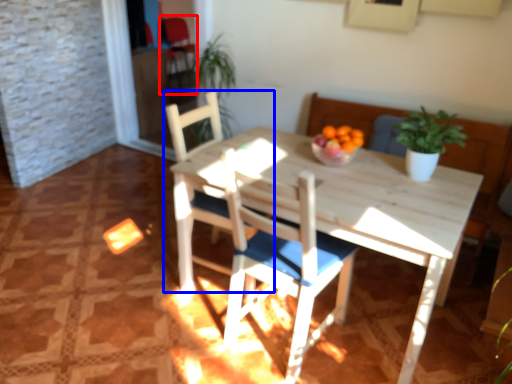
Question: Among these objects, which one is farthest to the camera, armchair (highlighted by a red box) or chair (highlighted by a blue box)?

Choices:
 (A) armchair
 (B) chair

Answer: (A)